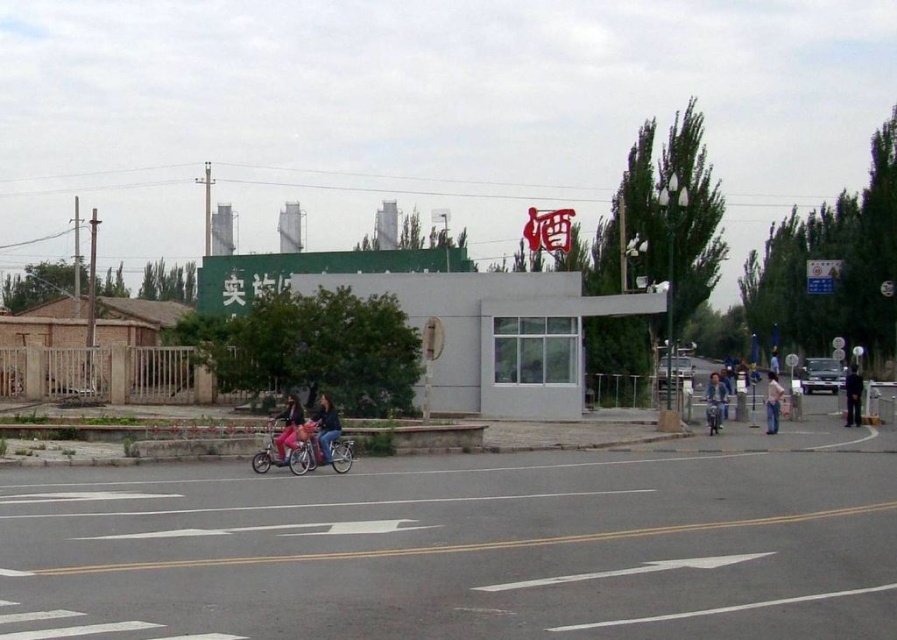
Looking at this image, you are standing at the pedestrian crossing and want to know where the pink matte bicycle at center is located relative to the point marked at coordinates (282, 445). Can you determine its position?

The pink matte bicycle at center is exactly at the point marked at coordinates (282, 445).